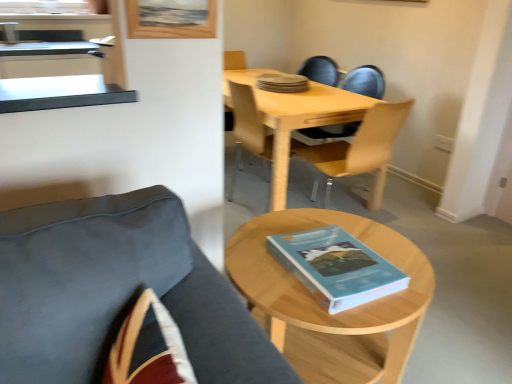
Where is `free space behind blue matte book at center, which ranks as the second book in top-to-bottom order`? This screenshot has height=384, width=512. free space behind blue matte book at center, which ranks as the second book in top-to-bottom order is located at coordinates (333, 225).